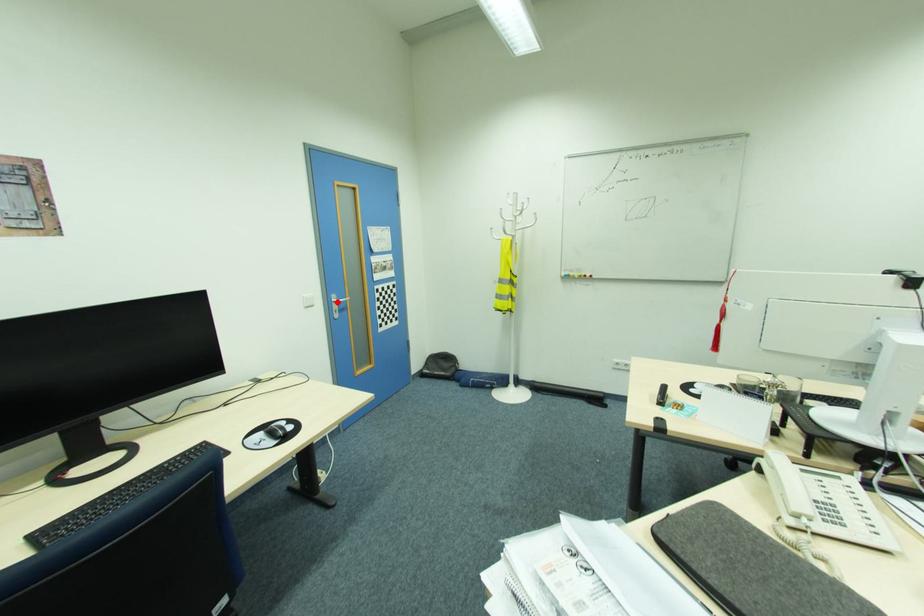
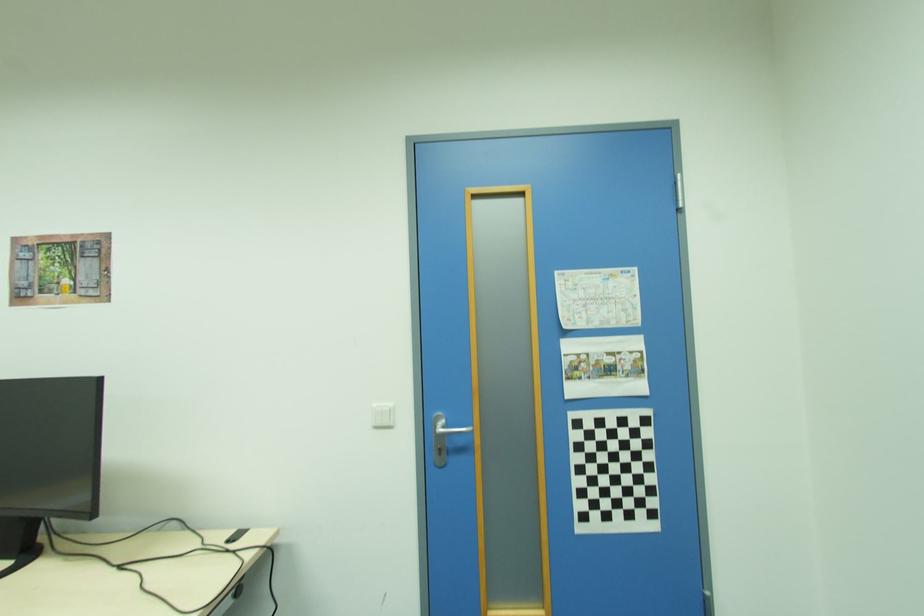
Find the pixel in the second image that matches the highlighted location in the first image.

(439, 429)